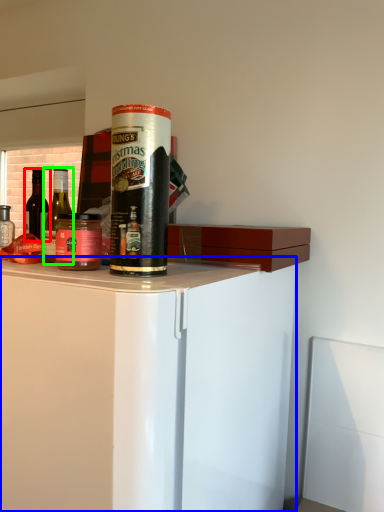
Question: Based on their relative distances, which object is farther from bottle (highlighted by a red box)? Choose from cabinetry (highlighted by a blue box) and bottle (highlighted by a green box).

Choices:
 (A) cabinetry
 (B) bottle

Answer: (B)